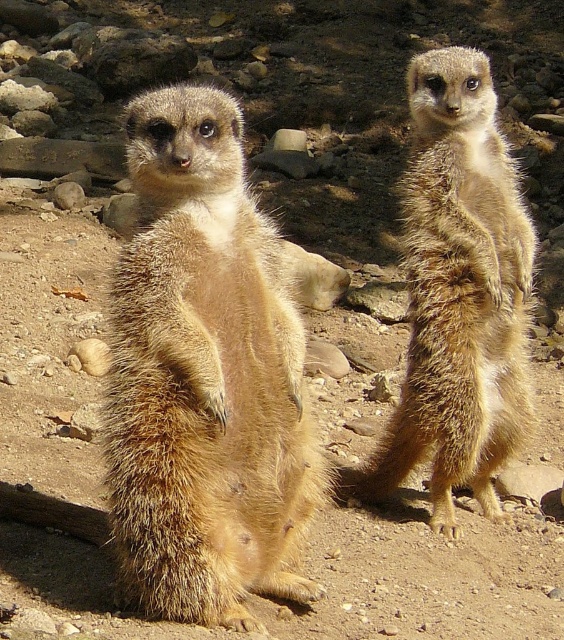
You are a wildlife photographer aiming to capture both the fuzzy golden meerkat at center and the golden fur meerkat at upper right in a single frame. Based on their heights, which meerkat should you adjust your camera angle to focus on first to ensure both are in focus?

The fuzzy golden meerkat at center is shorter than the golden fur meerkat at upper right. To ensure both are in focus, adjust your camera angle to focus on the golden fur meerkat at upper right first since it is taller, allowing the shorter meerkat at center to remain within the focal range.

Based on the photo, you are a photographer trying to capture a photo of the two meerkats in the image. You notice two points of interest marked as point 1 and point 2. Point 1 is at coordinates point (139, 214) and point 2 is at point (491, 253). Based on their positions, which point would you focus on first to ensure the meerkats are in sharp focus?

Point 1 at coordinates point (139, 214) is closer to the camera than point 2 at point (491, 253). Therefore, focusing on point 1 first would ensure the meerkats are in sharp focus since it is nearer to the camera.